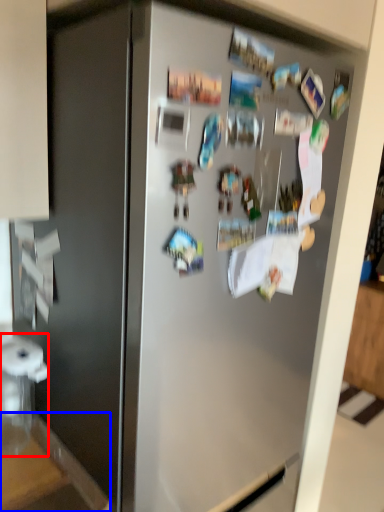
Question: Which point is further to the camera, appliance (highlighted by a red box) or counter top (highlighted by a blue box)?

Choices:
 (A) appliance
 (B) counter top

Answer: (A)